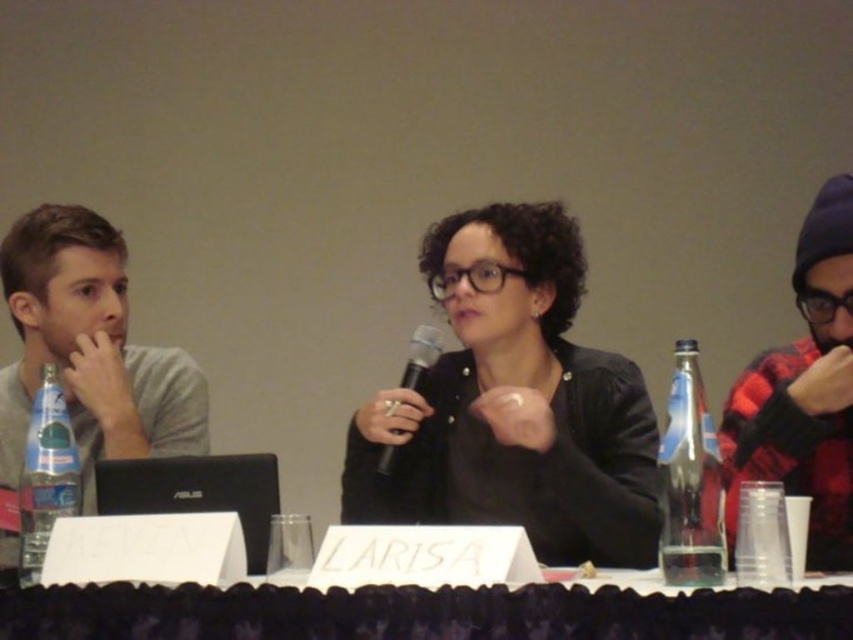
You are organizing a panel event and need to place a new nameplate between the clear plastic bottle at left and the black matte microphone at center. Can the nameplate fit between them if it measures 10 cm in width?

The clear plastic bottle at left is smaller than the black matte microphone at center, but the exact distance between them isn

Based on the photo, you are a photographer standing behind the central speaker at the panel discussion. You want to place a small decorative item between the two points labeled point (64,500) and point (418,368) on the table. Based on their positions, which point should the item be closer to in order to be placed in front of the other?

The item should be placed closer to point (64,500) because it is in front of point (418,368).